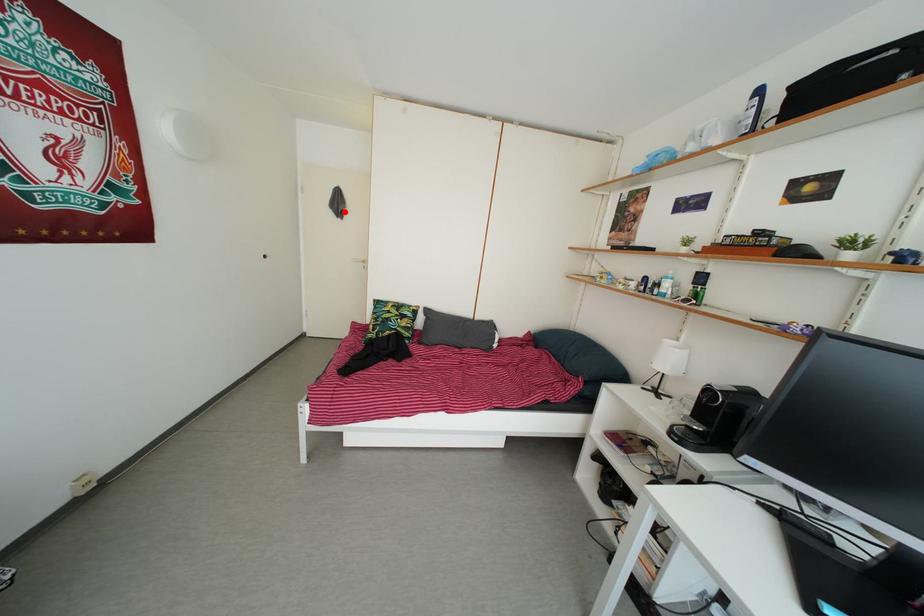
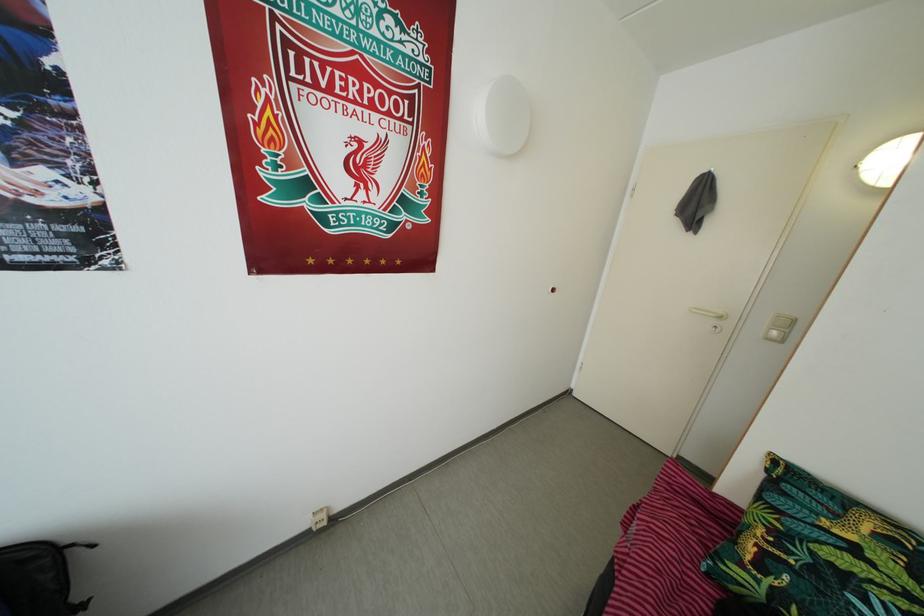
Where in the second image is the point corresponding to the highlighted location from the first image?

(703, 213)